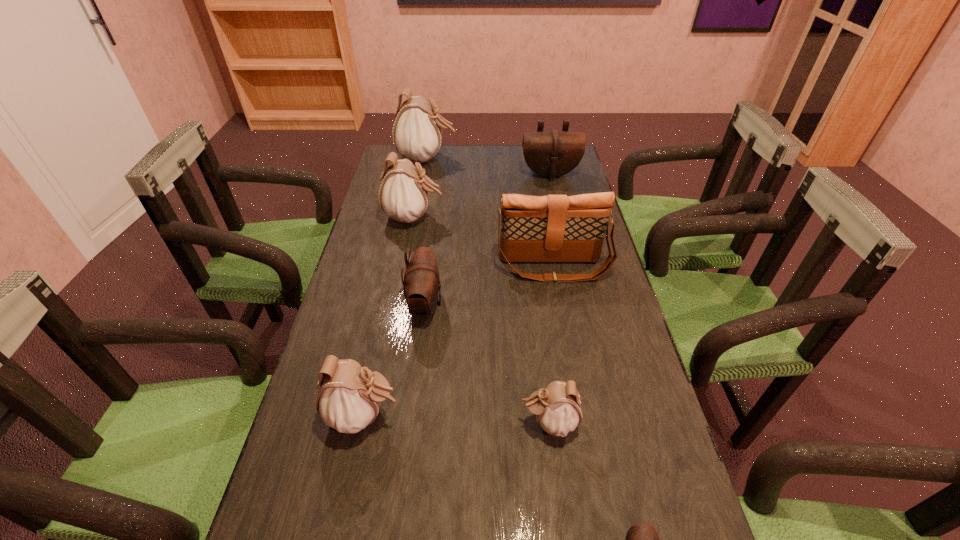
Where is `vacant area that lies between the second biggest brown pouch and the biggest white pouch`? vacant area that lies between the second biggest brown pouch and the biggest white pouch is located at coordinates (426, 231).

What are the coordinates of `vacant region between the second smallest white pouch and the rightmost white pouch` in the screenshot? It's located at (457, 418).

The width and height of the screenshot is (960, 540). I want to click on blank region between the biggest white pouch and the shoulder bag, so click(490, 213).

At what (x,y) coordinates should I click in order to perform the action: click on object that is the closest to the shoulder bag. Please return your answer as a coordinate pair (x, y). This screenshot has width=960, height=540. Looking at the image, I should click on 421,285.

Identify which object is the fourth closest to the smallest white pouch. Please provide its 2D coordinates. Your answer should be formatted as a tuple, i.e. [(x, y)], where the tuple contains the x and y coordinates of a point satisfying the conditions above.

[(554, 228)]

Locate which pouch is the sixth closest to the biggest brown pouch. Please provide its 2D coordinates. Your answer should be formatted as a tuple, i.e. [(x, y)], where the tuple contains the x and y coordinates of a point satisfying the conditions above.

[(641, 539)]

The height and width of the screenshot is (540, 960). I want to click on pouch that is the fourth closest to the fourth farthest pouch, so click(x=641, y=539).

Identify which white pouch is the fourth closest to the nearest object. Please provide its 2D coordinates. Your answer should be formatted as a tuple, i.e. [(x, y)], where the tuple contains the x and y coordinates of a point satisfying the conditions above.

[(417, 131)]

Choose which white pouch is the third nearest neighbor to the shoulder bag. Please provide its 2D coordinates. Your answer should be formatted as a tuple, i.e. [(x, y)], where the tuple contains the x and y coordinates of a point satisfying the conditions above.

[(349, 396)]

Where is `the closest brown pouch to the second smallest white pouch`? The image size is (960, 540). the closest brown pouch to the second smallest white pouch is located at coordinates (421, 285).